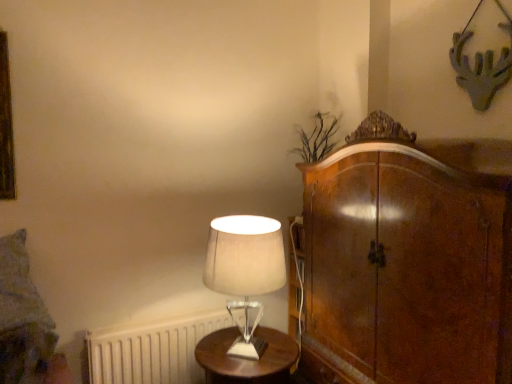
Question: Is point (164, 332) closer or farther from the camera than point (28, 292)?

Choices:
 (A) farther
 (B) closer

Answer: (A)

Question: Is white matte radiator at lower left situated inside textured gray pillow at left or outside?

Choices:
 (A) outside
 (B) inside

Answer: (A)

Question: Which object is positioned farthest from the textured gray pillow at left?

Choices:
 (A) wooden round table at center
 (B) white matte radiator at lower left
 (C) white fabric lampshade at center

Answer: (C)

Question: Considering the real-world distances, which object is farthest from the textured gray pillow at left?

Choices:
 (A) white fabric lampshade at center
 (B) white matte radiator at lower left
 (C) wooden round table at center

Answer: (A)